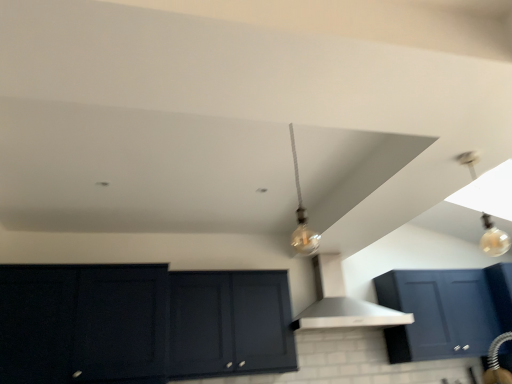
Question: From the image's perspective, does matte dark blue cabinet at lower left, which is counted as the first cabinetry, starting from the left, appear lower than translucent glass bulb at upper right?

Choices:
 (A) yes
 (B) no

Answer: (A)

Question: Can you confirm if matte dark blue cabinet at lower left, placed as the 2th cabinetry when sorted from right to left, is wider than translucent glass bulb at upper right?

Choices:
 (A) yes
 (B) no

Answer: (A)

Question: Can you confirm if matte dark blue cabinet at lower left, which is counted as the first cabinetry, starting from the left, is shorter than translucent glass bulb at upper right?

Choices:
 (A) yes
 (B) no

Answer: (B)

Question: From a real-world perspective, is matte dark blue cabinet at lower left, which is counted as the first cabinetry, starting from the left, positioned over translucent glass bulb at upper right based on gravity?

Choices:
 (A) yes
 (B) no

Answer: (B)

Question: Is matte dark blue cabinet at lower left, placed as the 2th cabinetry when sorted from right to left, outside translucent glass bulb at upper right?

Choices:
 (A) yes
 (B) no

Answer: (A)

Question: Is white matte vent at center to the left or to the right of matte black cabinet at center, the 1th cabinetry when ordered from right to left, in the image?

Choices:
 (A) right
 (B) left

Answer: (A)

Question: Looking at their shapes, would you say white matte vent at center is wider or thinner than matte black cabinet at center, which is the 2th cabinetry in left-to-right order?

Choices:
 (A) wide
 (B) thin

Answer: (A)

Question: From the image's perspective, is white matte vent at center located above or below matte black cabinet at center, the 1th cabinetry when ordered from right to left?

Choices:
 (A) below
 (B) above

Answer: (B)

Question: In terms of size, does white matte vent at center appear bigger or smaller than matte black cabinet at center, which is the 2th cabinetry in left-to-right order?

Choices:
 (A) small
 (B) big

Answer: (B)

Question: Considering the positions of white matte vent at center and matte dark blue cabinet at lower left, which is counted as the first cabinetry, starting from the left, in the image, is white matte vent at center bigger or smaller than matte dark blue cabinet at lower left, which is counted as the first cabinetry, starting from the left,?

Choices:
 (A) big
 (B) small

Answer: (B)

Question: Visually, is white matte vent at center positioned to the left or to the right of matte dark blue cabinet at lower left, placed as the 2th cabinetry when sorted from right to left?

Choices:
 (A) right
 (B) left

Answer: (A)

Question: Choose the correct answer: Is white matte vent at center inside matte dark blue cabinet at lower left, placed as the 2th cabinetry when sorted from right to left, or outside it?

Choices:
 (A) outside
 (B) inside

Answer: (A)

Question: From their relative heights in the image, would you say white matte vent at center is taller or shorter than matte dark blue cabinet at lower left, placed as the 2th cabinetry when sorted from right to left?

Choices:
 (A) tall
 (B) short

Answer: (B)

Question: From the image's perspective, relative to white matte vent at center, is translucent glass bulb at upper right above or below?

Choices:
 (A) below
 (B) above

Answer: (B)

Question: From a real-world perspective, is translucent glass bulb at upper right above or below white matte vent at center?

Choices:
 (A) below
 (B) above

Answer: (B)